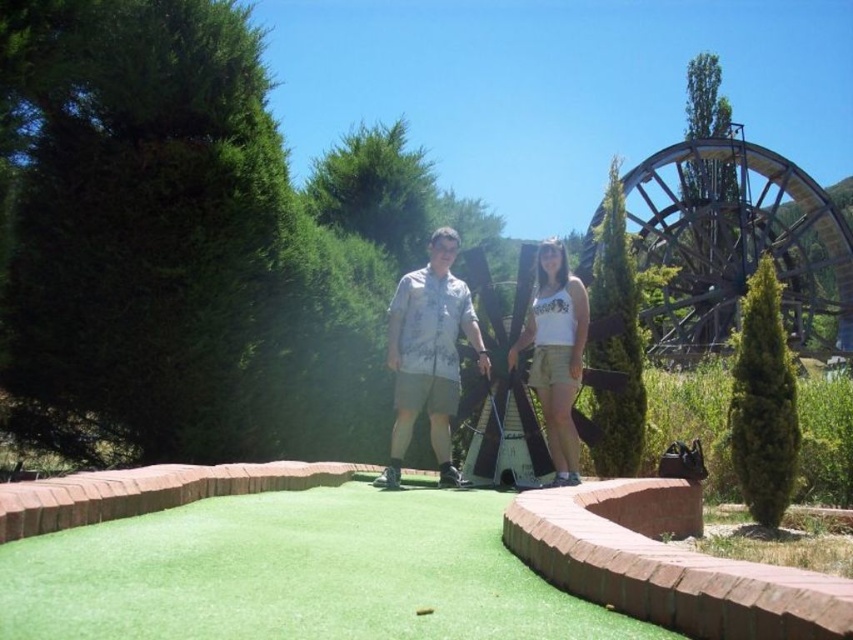
Question: Does green artificial turf at center have a smaller size compared to white cotton tank top at center?

Choices:
 (A) yes
 (B) no

Answer: (B)

Question: Considering the relative positions of green artificial turf at center and light gray shirt at center in the image provided, where is green artificial turf at center located with respect to light gray shirt at center?

Choices:
 (A) right
 (B) left

Answer: (B)

Question: Which of the following is the farthest from the observer?

Choices:
 (A) light gray shirt at center
 (B) green artificial turf at center
 (C) white cotton tank top at center

Answer: (C)

Question: Which point appears farthest from the camera in this image?

Choices:
 (A) (548, 419)
 (B) (448, 372)

Answer: (A)

Question: Is green artificial turf at center positioned at the back of light gray shirt at center?

Choices:
 (A) no
 (B) yes

Answer: (A)

Question: Which point appears closest to the camera in this image?

Choices:
 (A) (405, 384)
 (B) (578, 324)
 (C) (363, 620)

Answer: (C)